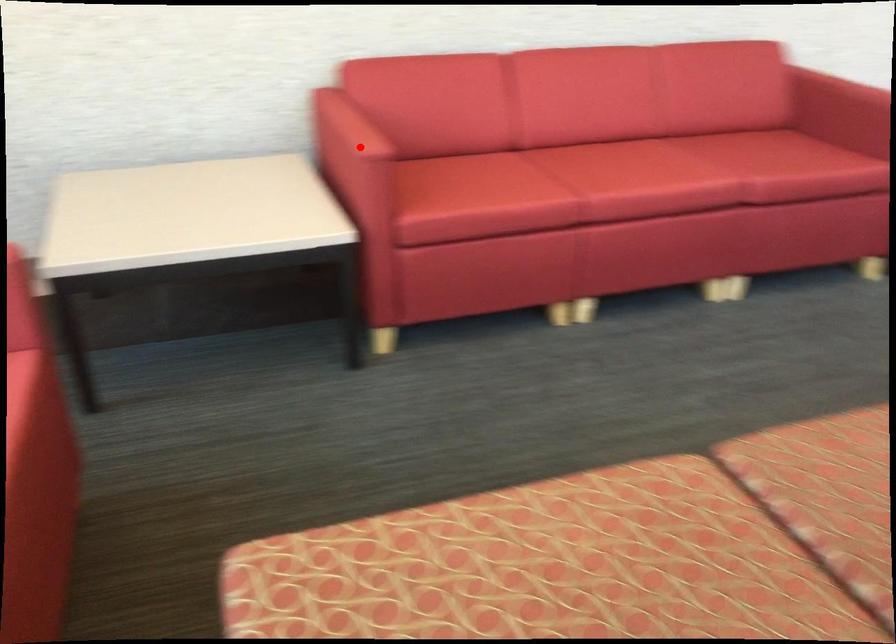
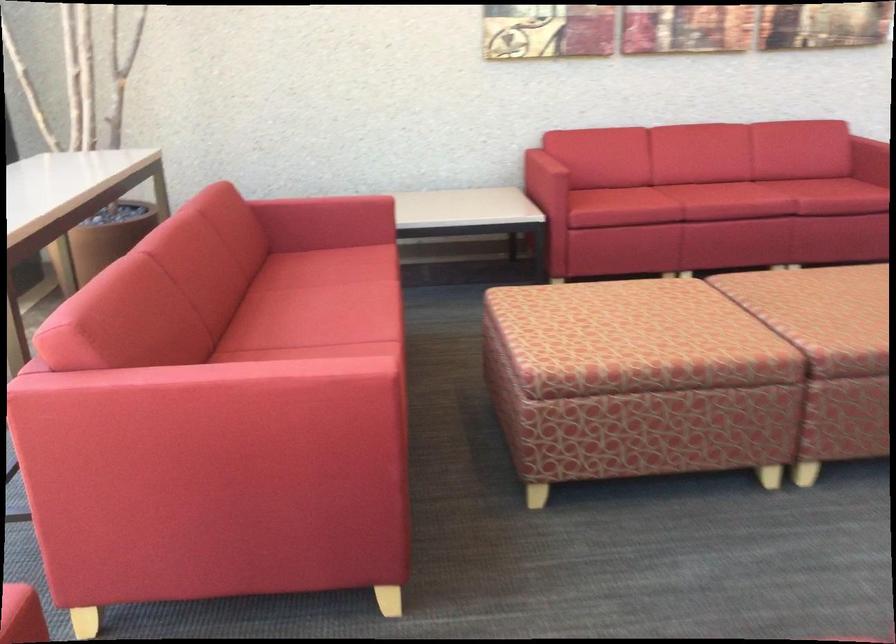
Question: I am providing you with two images of the same scene from different viewpoints. A red point is marked on the first image. Is the red point's position out of view in image 2?

Choices:
 (A) Yes
 (B) No

Answer: (B)